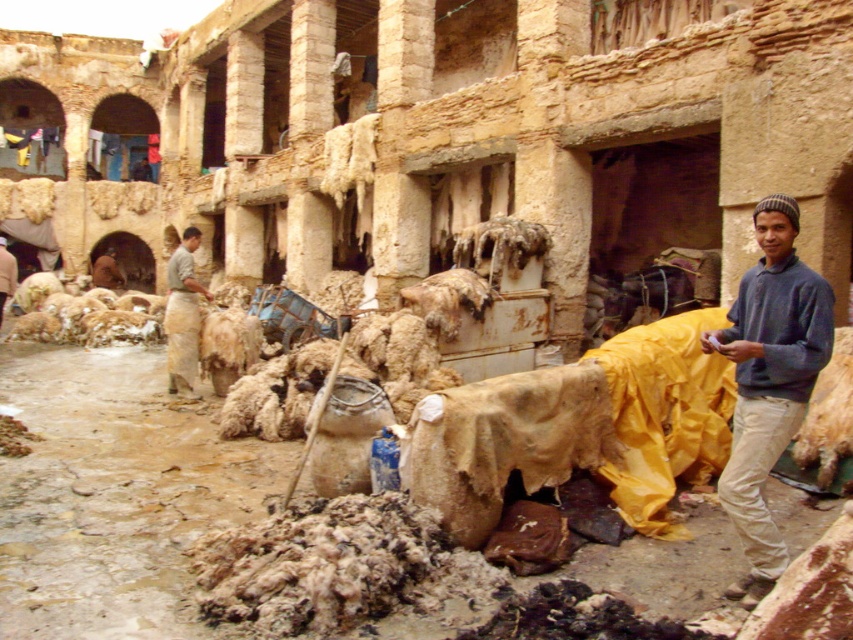
The height and width of the screenshot is (640, 853). What do you see at coordinates (769, 381) in the screenshot?
I see `dark blue sweater at right` at bounding box center [769, 381].

Is dark blue sweater at right bigger than brown leather jacket at center?

Yes.

At what (x,y) coordinates should I click in order to perform the action: click on dark blue sweater at right. Please return your answer as a coordinate pair (x, y). Looking at the image, I should click on (769, 381).

Where is `dark blue sweater at right`? The height and width of the screenshot is (640, 853). dark blue sweater at right is located at coordinates (769, 381).

Between dark blue sweater at right and light brown fabric apron at center, which one is positioned lower?

dark blue sweater at right is lower down.

Between dark blue sweater at right and light brown fabric apron at center, which one is positioned higher?

light brown fabric apron at center is above.

Find the location of a particular element. This screenshot has height=640, width=853. dark blue sweater at right is located at coordinates (769, 381).

Based on the photo, which is below, light brown fabric apron at center or brown woolen sweater at center?

Positioned lower is light brown fabric apron at center.

The height and width of the screenshot is (640, 853). What do you see at coordinates (183, 316) in the screenshot?
I see `light brown fabric apron at center` at bounding box center [183, 316].

Find the location of `light brown fabric apron at center`. light brown fabric apron at center is located at coordinates (183, 316).